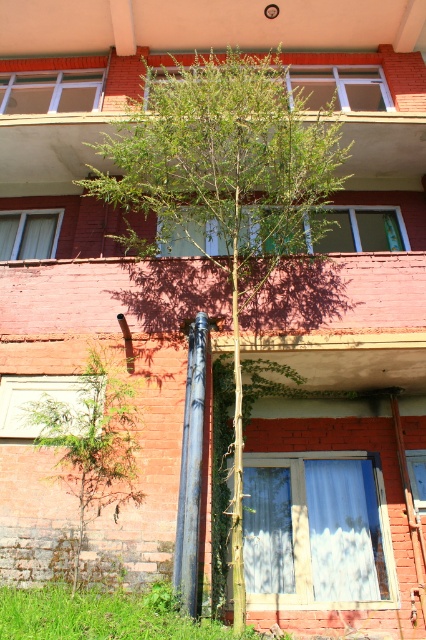
You are standing in front of the building and notice two points marked on the wall. The first point is at coordinates point (233, 163) and the second is at point (199, 426). Which point is closer to you?

Point (199, 426) is closer to you because it is in front of point (233, 163).

You are standing in front of the building and want to determine which of the two points, point (302, 145) or point (97, 429), is closer to you. Based on the image, which point is nearer?

Point (302, 145) is closer to you than point (97, 429) because it is further to the viewer in the image.